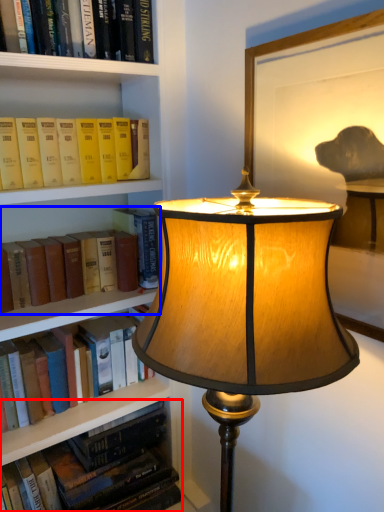
Question: Which object appears farthest to the camera in this image, book (highlighted by a red box) or book (highlighted by a blue box)?

Choices:
 (A) book
 (B) book

Answer: (A)